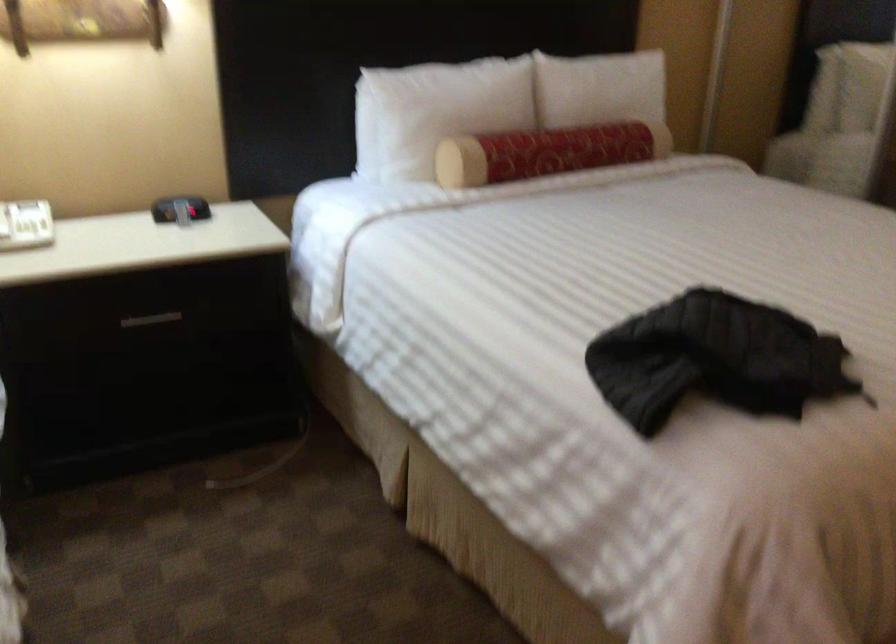
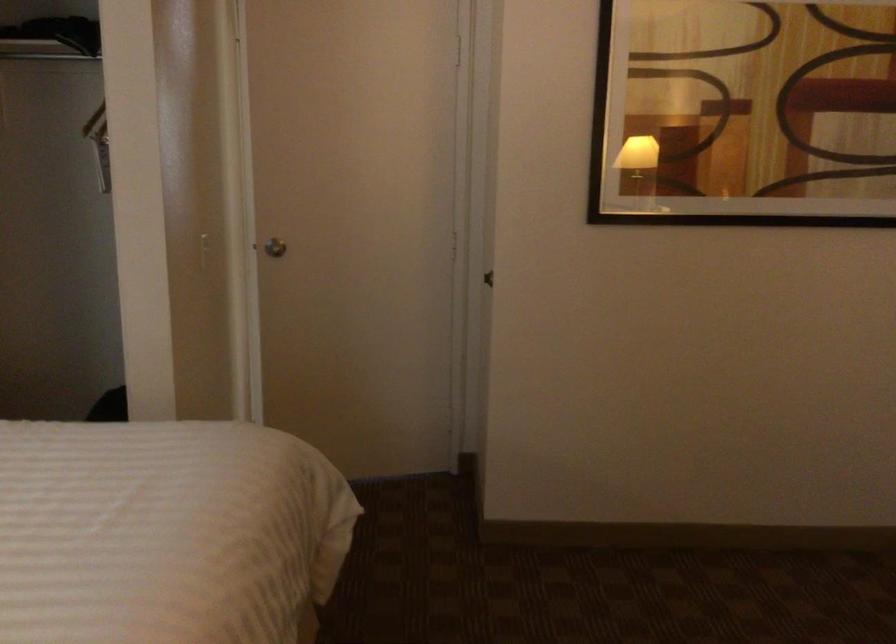
Question: Based on the continuous images, in which direction is the camera rotating? Reply with the corresponding letter.

Choices:
 (A) Left
 (B) Right
 (C) Up
 (D) Down

Answer: (B)